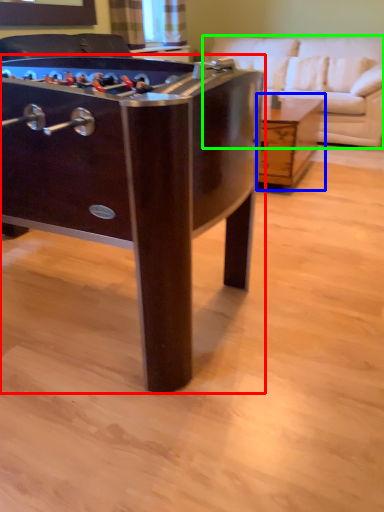
Question: Which object is positioned closest to table (highlighted by a red box)? Select from table (highlighted by a blue box) and studio couch (highlighted by a green box).

Choices:
 (A) table
 (B) studio couch

Answer: (A)